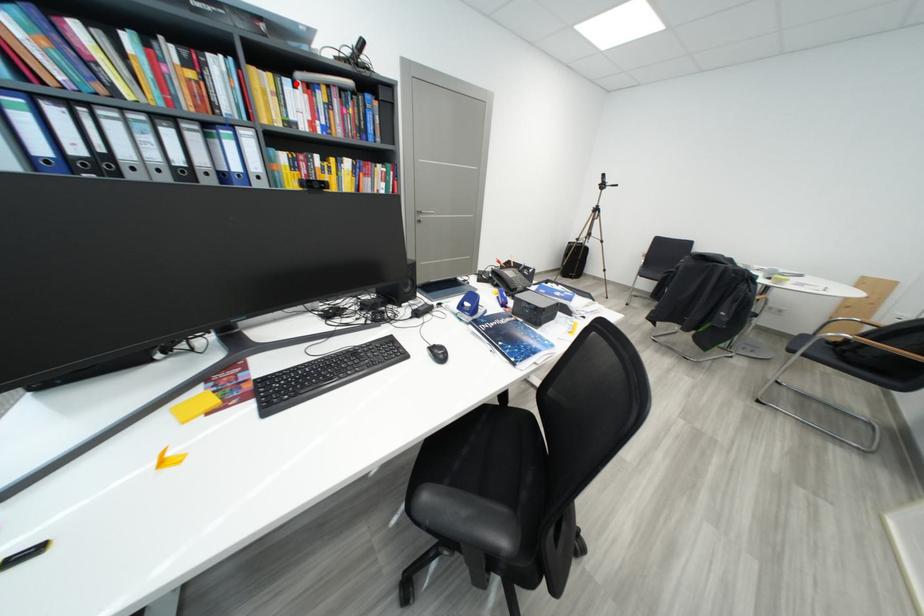
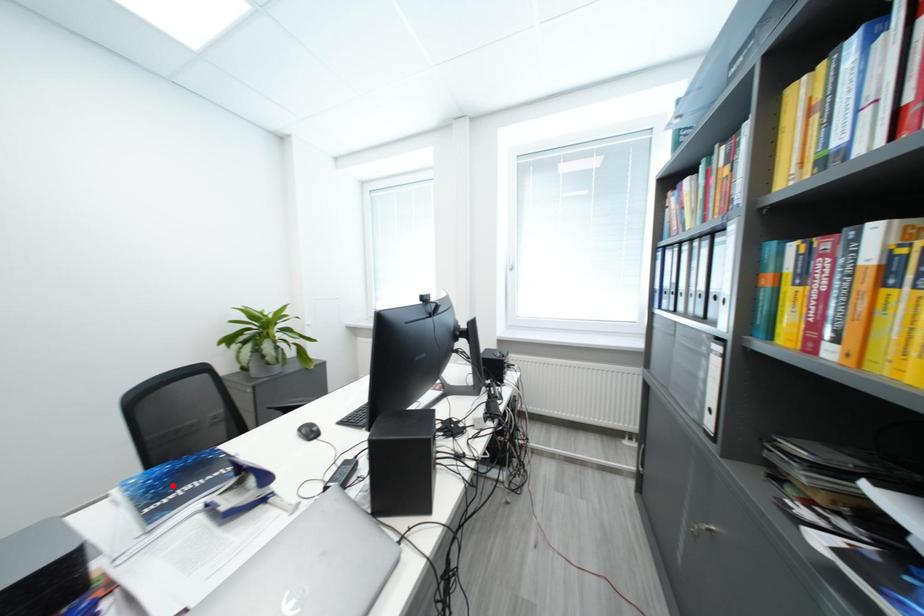
I am providing you with two images of the same scene from different viewpoints. A red point is marked on the first image and another point is marked on the second image. Is the red point in image1 aligned with the point shown in image2?

No